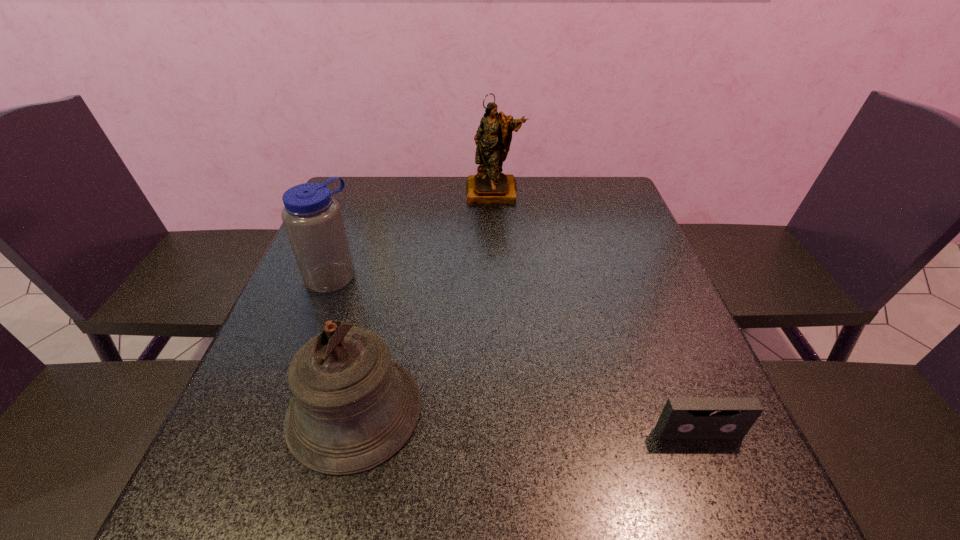
Where is `bell`? bell is located at coordinates (x=353, y=408).

The height and width of the screenshot is (540, 960). I want to click on the rightmost object, so click(x=682, y=417).

Find the location of a particular element. The height and width of the screenshot is (540, 960). the shortest object is located at coordinates (682, 417).

The height and width of the screenshot is (540, 960). I want to click on the tallest object, so click(493, 138).

In order to click on figurine in this screenshot , I will do `click(493, 138)`.

The image size is (960, 540). What are the coordinates of `the second farthest object` in the screenshot? It's located at (313, 221).

Locate an element on the screen. The image size is (960, 540). free spot located 0.330m on the right of the bell is located at coordinates (604, 410).

This screenshot has width=960, height=540. I want to click on vacant space situated 0.090m on the front-facing side of the second object from right to left, so click(494, 222).

You are a GUI agent. You are given a task and a screenshot of the screen. Output one action in this format:
    pyautogui.click(x=<x>, y=<y>)
    Task: Click on the vacant space located 0.310m on the front-facing side of the second object from right to left
    The width and height of the screenshot is (960, 540).
    Given the screenshot: What is the action you would take?
    pyautogui.click(x=495, y=273)

You are a GUI agent. You are given a task and a screenshot of the screen. Output one action in this format:
    pyautogui.click(x=<x>, y=<y>)
    Task: Click on the vacant point located on the front-facing side of the second object from right to left
    
    Given the screenshot: What is the action you would take?
    pyautogui.click(x=495, y=262)